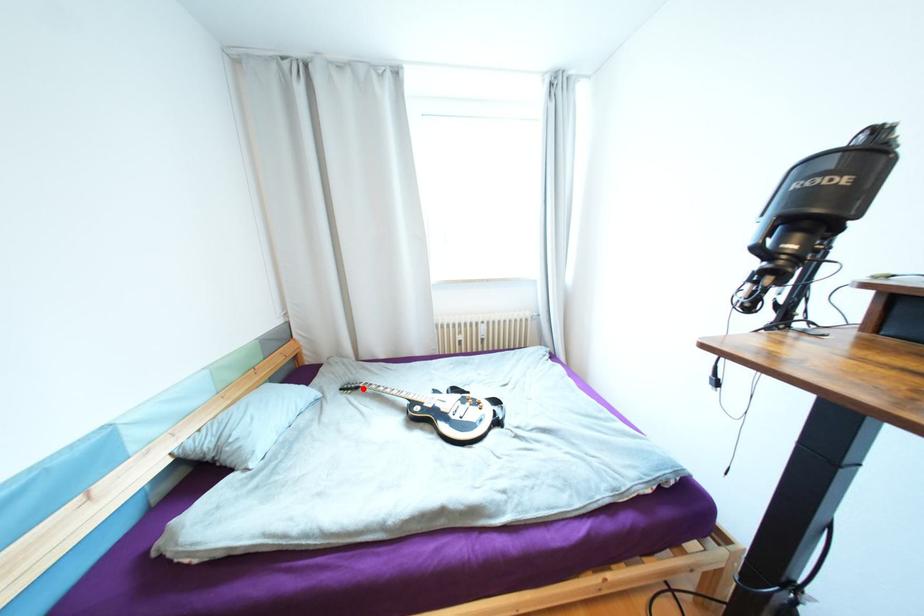
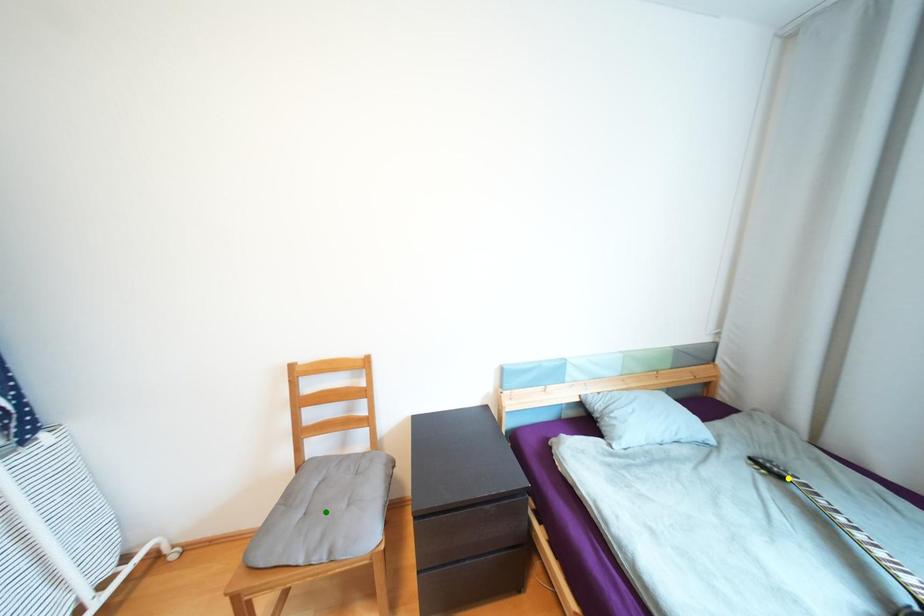
Question: I am providing you with two images of the same scene from different viewpoints. A red point is marked on the first image. You are given multiple points on the second image. Which spot in image 2 lines up with the point in image 1?

Choices:
 (A) yellow point
 (B) blue point
 (C) green point

Answer: (A)